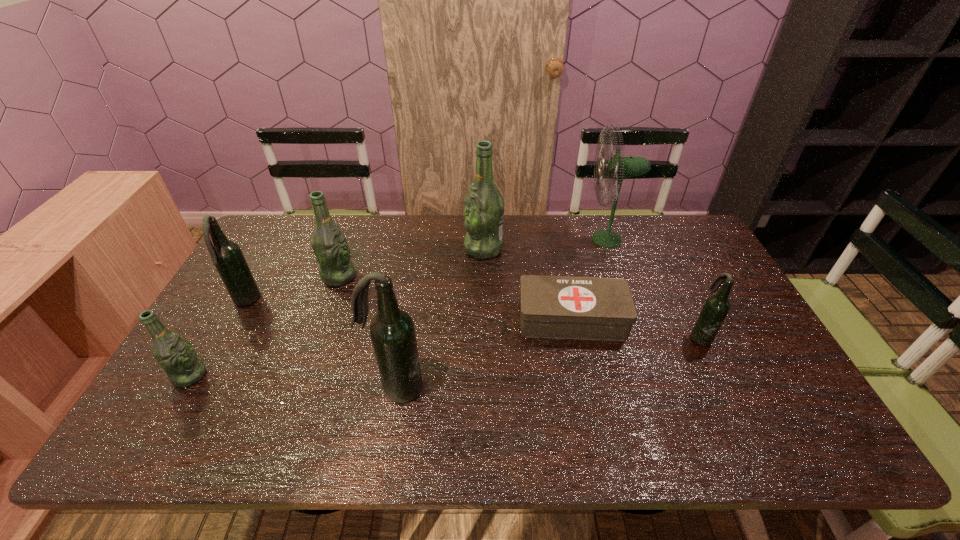
The height and width of the screenshot is (540, 960). I want to click on the second farthest dark beer bottle, so click(x=716, y=307).

At what (x,y) coordinates should I click in order to perform the action: click on the smallest green beer bottle. Please return your answer as a coordinate pair (x, y). This screenshot has width=960, height=540. Looking at the image, I should click on (175, 354).

This screenshot has height=540, width=960. I want to click on the leftmost green beer bottle, so click(x=175, y=354).

At what (x,y) coordinates should I click in order to perform the action: click on the first-aid kit. Please return your answer as a coordinate pair (x, y). This screenshot has height=540, width=960. Looking at the image, I should click on (591, 308).

At what (x,y) coordinates should I click in order to perform the action: click on vacant region located 0.210m on the front-facing side of the fan. Please return your answer as a coordinate pair (x, y). Looking at the image, I should click on (525, 239).

Find the location of `free location located 0.220m on the front-facing side of the fan`. free location located 0.220m on the front-facing side of the fan is located at coordinates (522, 239).

Where is `vacant space located 0.260m on the front-facing side of the fan`? The height and width of the screenshot is (540, 960). vacant space located 0.260m on the front-facing side of the fan is located at coordinates (511, 239).

This screenshot has height=540, width=960. Find the location of `free space located on the surface of the fourth object from right to left`. free space located on the surface of the fourth object from right to left is located at coordinates (357, 248).

Locate an element on the screen. This screenshot has width=960, height=540. blank space located 0.100m on the surface of the fourth object from right to left is located at coordinates [x=435, y=248].

Where is `vacant area situated 0.090m on the surface of the fourth object from right to left`? This screenshot has width=960, height=540. vacant area situated 0.090m on the surface of the fourth object from right to left is located at coordinates (438, 248).